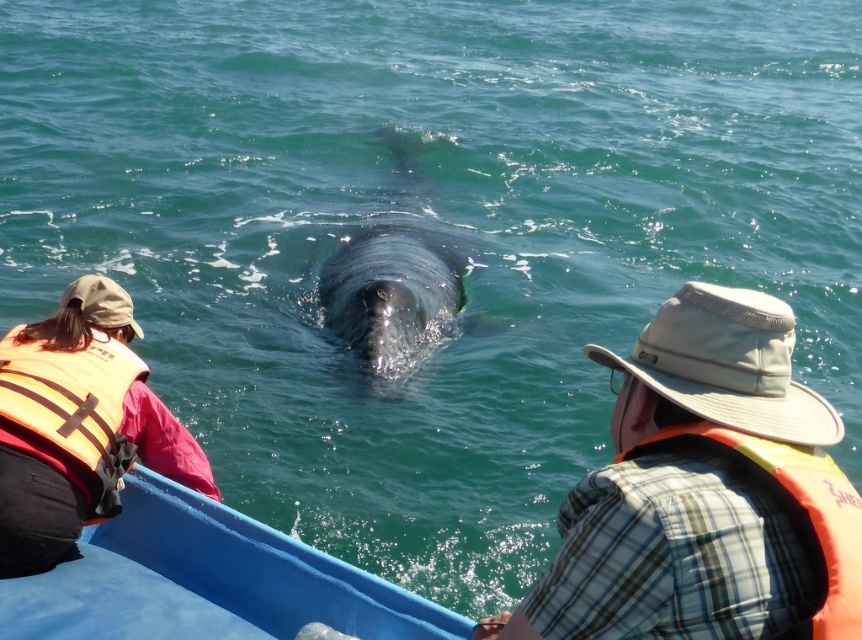
Question: Which point is closer to the camera?

Choices:
 (A) orange/yellow fabric life jacket at lower right
 (B) gray matte whale at center
 (C) orange/yellow fabric life jacket at left

Answer: (A)

Question: From the image, what is the correct spatial relationship of plaid shirt at center in relation to gray matte whale at center?

Choices:
 (A) above
 (B) below

Answer: (B)

Question: Which point is farther to the camera?

Choices:
 (A) orange/yellow fabric life jacket at left
 (B) plaid shirt at center
 (C) gray matte whale at center

Answer: (C)

Question: Considering the real-world distances, which object is farthest from the gray matte whale at center?

Choices:
 (A) orange life vest at left
 (B) plaid shirt at center
 (C) orange/yellow fabric life jacket at left
 (D) blue plastic boat at center

Answer: (B)

Question: Observing the image, what is the correct spatial positioning of blue plastic boat at center in reference to orange/yellow fabric life jacket at lower right?

Choices:
 (A) right
 (B) left

Answer: (B)

Question: Is plaid shirt at center thinner than gray matte whale at center?

Choices:
 (A) no
 (B) yes

Answer: (B)